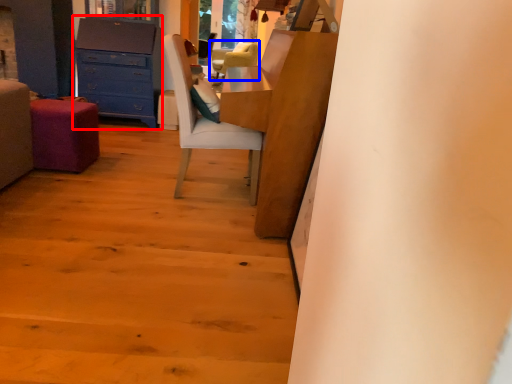
Question: Among these objects, which one is nearest to the camera, chest of drawers (highlighted by a red box) or chair (highlighted by a blue box)?

Choices:
 (A) chest of drawers
 (B) chair

Answer: (A)